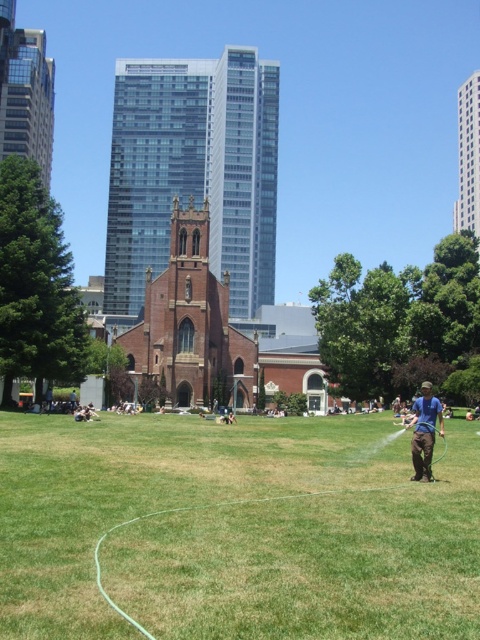
Is point (216, 428) in front of point (130, 141)?

Yes.

Can you confirm if green grass at center is taller than red brick church at center?

No.

This screenshot has width=480, height=640. What do you see at coordinates (235, 529) in the screenshot? I see `green grass at center` at bounding box center [235, 529].

I want to click on green grass at center, so click(x=235, y=529).

Based on the photo, can you confirm if green grass at center is wider than blue fabric at right?

Yes.

Does green grass at center appear on the left side of blue fabric at right?

Yes, green grass at center is to the left of blue fabric at right.

Which is behind, point (108, 480) or point (424, 381)?

Positioned behind is point (424, 381).

I want to click on green grass at center, so click(x=235, y=529).

The image size is (480, 640). Describe the element at coordinates (468, 156) in the screenshot. I see `brown stone church at center` at that location.

Is brown stone church at center thinner than blue fabric at right?

Yes, brown stone church at center is thinner than blue fabric at right.

Does point (471, 156) come behind point (437, 417)?

Yes, it is.

Image resolution: width=480 pixels, height=640 pixels. I want to click on brown stone church at center, so click(x=468, y=156).